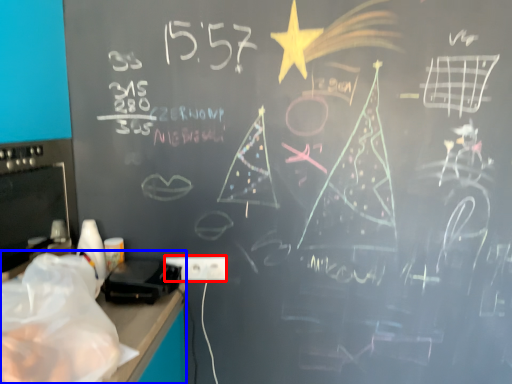
Question: Among these objects, which one is nearest to the camera, electric outlet (highlighted by a red box) or computer desk (highlighted by a blue box)?

Choices:
 (A) electric outlet
 (B) computer desk

Answer: (B)